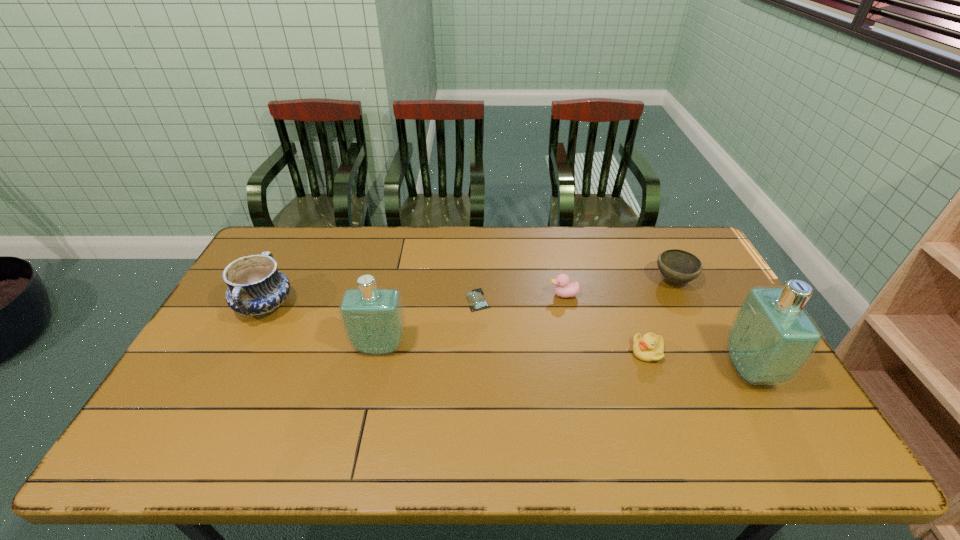
Where is `bowl present at the right edge`? bowl present at the right edge is located at coordinates (677, 266).

Where is `object that is at the far right corner`? This screenshot has height=540, width=960. object that is at the far right corner is located at coordinates (677, 266).

Where is `object present at the near right corner`? object present at the near right corner is located at coordinates (771, 338).

In the image, there is a desktop. At what (x,y) coordinates should I click in order to perform the action: click on blank space at the far edge. Please return your answer as a coordinate pair (x, y). This screenshot has height=540, width=960. Looking at the image, I should click on (609, 237).

Where is `vacant region at the near edge of the desktop`? The height and width of the screenshot is (540, 960). vacant region at the near edge of the desktop is located at coordinates (706, 392).

The image size is (960, 540). In the image, there is a desktop. What are the coordinates of `vacant space at the left edge` in the screenshot? It's located at (186, 374).

This screenshot has width=960, height=540. In the image, there is a desktop. Identify the location of vacant region at the far left corner. tap(280, 267).

Image resolution: width=960 pixels, height=540 pixels. Find the location of `free space that is in between the nearer duckling and the fifth shortest object`. free space that is in between the nearer duckling and the fifth shortest object is located at coordinates (456, 329).

Where is `free space between the bowl and the right duckling`? This screenshot has height=540, width=960. free space between the bowl and the right duckling is located at coordinates (660, 316).

I want to click on free spot between the identity card and the second object from left to right, so click(x=429, y=323).